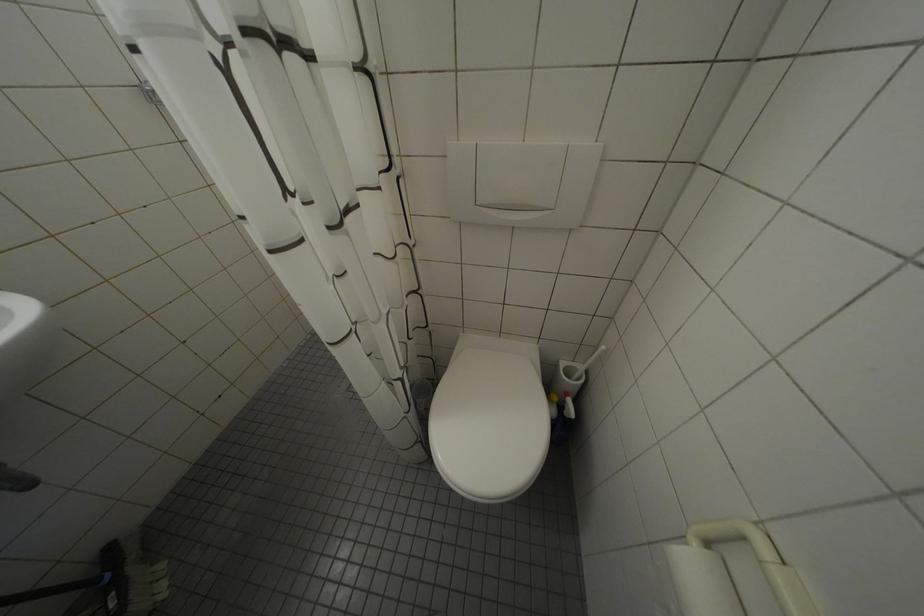
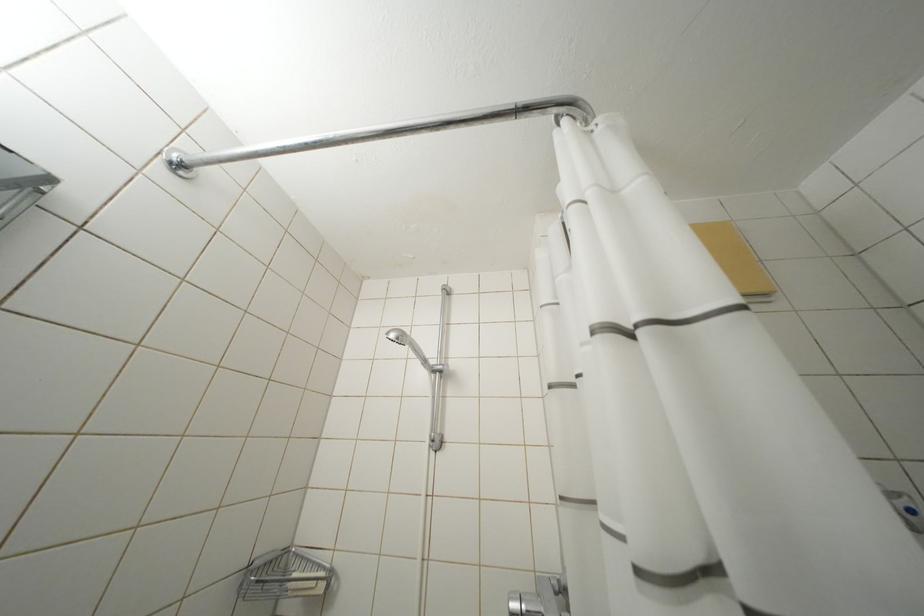
Question: How did the camera likely rotate?

Choices:
 (A) Left
 (B) Right
 (C) Up
 (D) Down

Answer: (C)